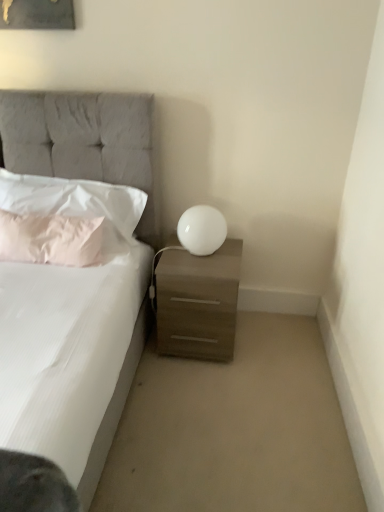
Question: Would you say white fabric pillow at left, positioned as the 2th pillow in bottom-to-top order, is part of white glossy sphere at right's contents?

Choices:
 (A) yes
 (B) no

Answer: (B)

Question: Is white glossy sphere at right bigger than white fabric pillow at left, positioned as the 2th pillow in bottom-to-top order?

Choices:
 (A) no
 (B) yes

Answer: (A)

Question: From the image's perspective, would you say white glossy sphere at right is positioned over white fabric pillow at left, positioned as the 2th pillow in bottom-to-top order?

Choices:
 (A) no
 (B) yes

Answer: (A)

Question: Does white glossy sphere at right lie in front of white fabric pillow at left, positioned as the 2th pillow in bottom-to-top order?

Choices:
 (A) yes
 (B) no

Answer: (B)

Question: From the image's perspective, is white glossy sphere at right beneath white fabric pillow at left, positioned as the 2th pillow in bottom-to-top order?

Choices:
 (A) no
 (B) yes

Answer: (B)

Question: Visually, is tufted fabric bed at upper left positioned to the left or to the right of pink fabric pillow at left, positioned as the 1th pillow in bottom-to-top order?

Choices:
 (A) left
 (B) right

Answer: (A)

Question: In the image, is tufted fabric bed at upper left positioned in front of or behind pink fabric pillow at left, positioned as the 1th pillow in bottom-to-top order?

Choices:
 (A) front
 (B) behind

Answer: (A)

Question: From a real-world perspective, is tufted fabric bed at upper left physically located above or below pink fabric pillow at left, arranged as the second pillow when viewed from the top?

Choices:
 (A) below
 (B) above

Answer: (A)

Question: Is tufted fabric bed at upper left taller or shorter than pink fabric pillow at left, positioned as the 1th pillow in bottom-to-top order?

Choices:
 (A) tall
 (B) short

Answer: (A)

Question: Does point (51, 187) appear closer or farther from the camera than point (132, 151)?

Choices:
 (A) closer
 (B) farther

Answer: (B)

Question: Based on their positions, is white fabric pillow at left, which ranks as the 1th pillow in top-to-bottom order, located to the left or right of tufted fabric bed at upper left?

Choices:
 (A) left
 (B) right

Answer: (B)

Question: Would you say white fabric pillow at left, which ranks as the 1th pillow in top-to-bottom order, is inside or outside tufted fabric bed at upper left?

Choices:
 (A) inside
 (B) outside

Answer: (A)

Question: In terms of width, does white fabric pillow at left, positioned as the 2th pillow in bottom-to-top order, look wider or thinner when compared to tufted fabric bed at upper left?

Choices:
 (A) wide
 (B) thin

Answer: (B)

Question: From the image's perspective, is white glossy sphere at right located above or below matte wood nightstand at lower right?

Choices:
 (A) above
 (B) below

Answer: (A)

Question: Looking at their shapes, would you say white glossy sphere at right is wider or thinner than matte wood nightstand at lower right?

Choices:
 (A) wide
 (B) thin

Answer: (B)